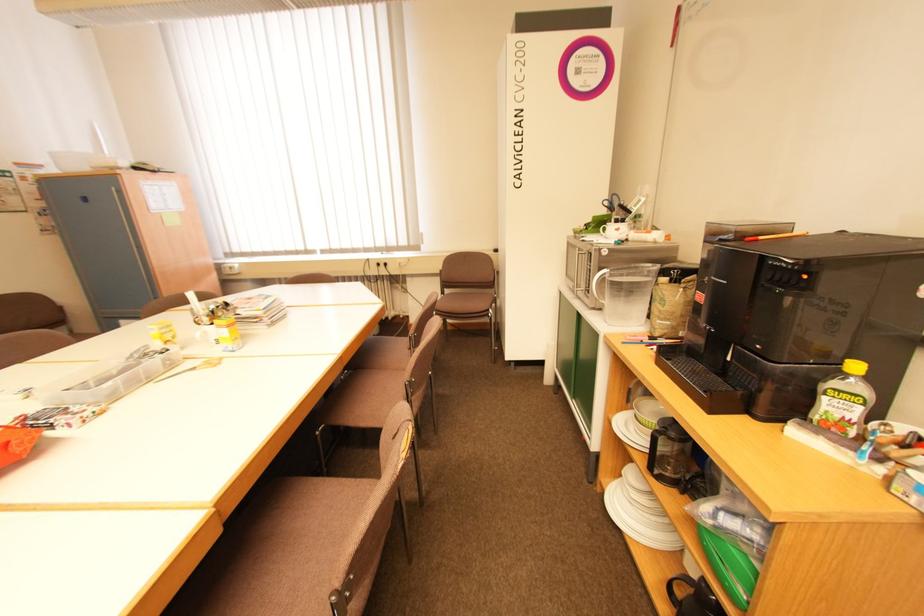
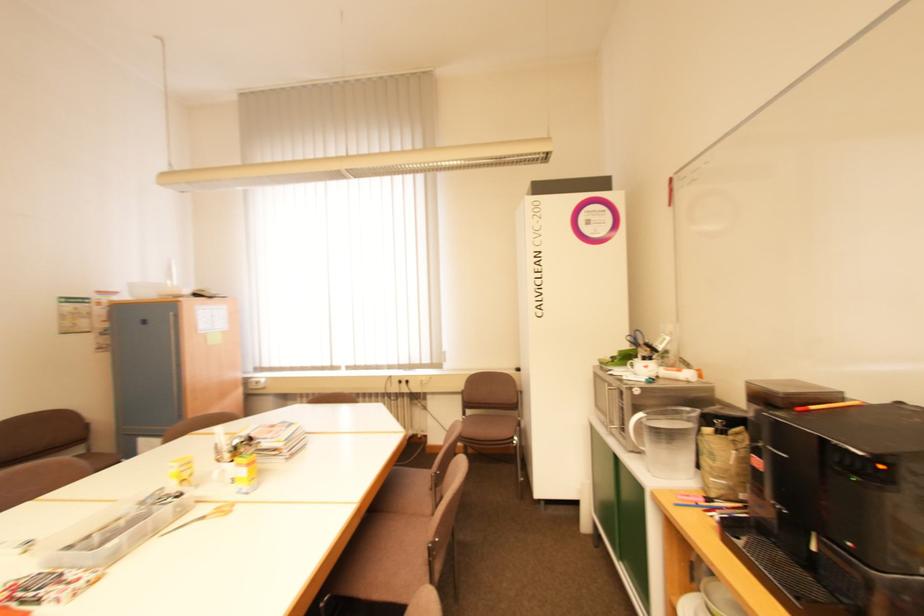
From the picture: In a continuous first-person perspective shot, in which direction is the camera moving?

The movement direction of the cameraman is left, backward.